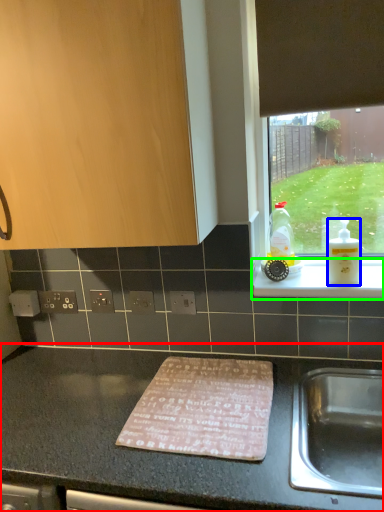
Question: Which is farther away from countertop (highlighted by a red box)? bottle (highlighted by a blue box) or ledge (highlighted by a green box)?

Choices:
 (A) bottle
 (B) ledge

Answer: (A)